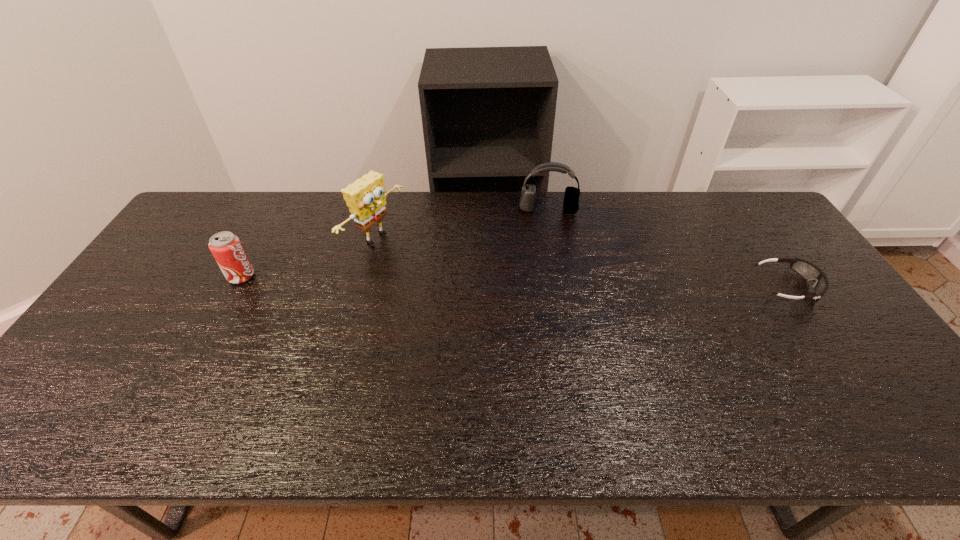
At what (x,y) coordinates should I click in order to perform the action: click on free space between the third object from right to left and the shortest object. Please return your answer as a coordinate pair (x, y). The width and height of the screenshot is (960, 540). Looking at the image, I should click on (581, 262).

Image resolution: width=960 pixels, height=540 pixels. I want to click on unoccupied position between the goggles and the headset, so click(x=667, y=248).

Identify which object is located as the second nearest to the sponge. Please provide its 2D coordinates. Your answer should be formatted as a tuple, i.e. [(x, y)], where the tuple contains the x and y coordinates of a point satisfying the conditions above.

[(571, 197)]

The width and height of the screenshot is (960, 540). I want to click on object that is the third closest to the headset, so click(x=226, y=247).

Locate an element on the screen. This screenshot has width=960, height=540. free space that satisfies the following two spatial constraints: 1. on the front side of the rightmost object; 2. on the front and sides of the second object from left to right is located at coordinates (363, 287).

At what (x,y) coordinates should I click in order to perform the action: click on free region that satisfies the following two spatial constraints: 1. on the front side of the headset; 2. on the front and sides of the shortest object. Please return your answer as a coordinate pair (x, y). This screenshot has height=540, width=960. Looking at the image, I should click on (563, 287).

What are the coordinates of `vacant space that satisfies the following two spatial constraints: 1. on the front side of the sponge; 2. on the front and sides of the rightmost object` in the screenshot? It's located at (363, 287).

You are a GUI agent. You are given a task and a screenshot of the screen. Output one action in this format:
    pyautogui.click(x=<x>, y=<y>)
    Task: Click on the vacant position in the image that satisfies the following two spatial constraints: 1. on the back side of the third tallest object; 2. on the left side of the sponge
    The width and height of the screenshot is (960, 540).
    Given the screenshot: What is the action you would take?
    262,238

Locate an element on the screen. The image size is (960, 540). vacant point that satisfies the following two spatial constraints: 1. on the back side of the sponge; 2. on the right side of the second tallest object is located at coordinates click(383, 210).